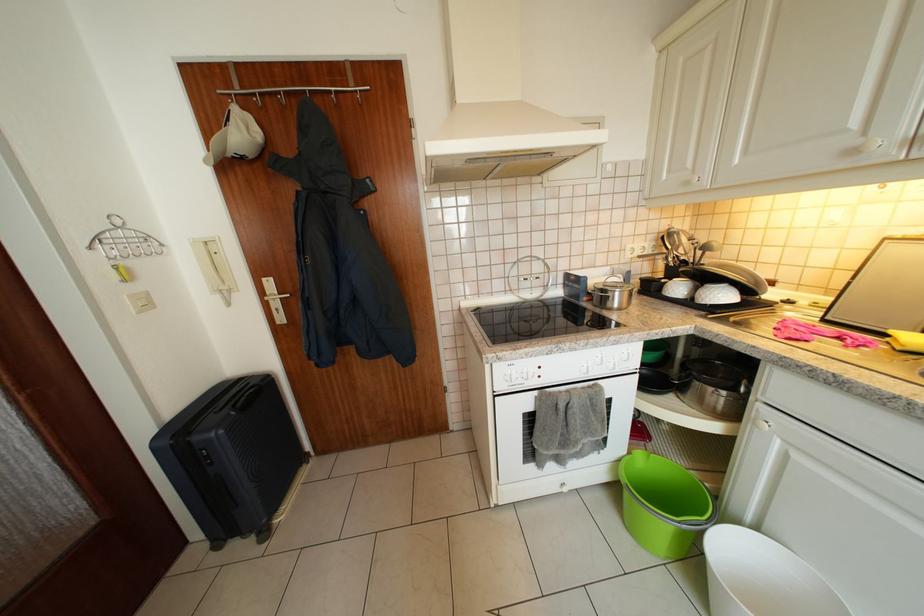
This screenshot has width=924, height=616. Find the location of `suitcase handle`. suitcase handle is located at coordinates (232, 402).